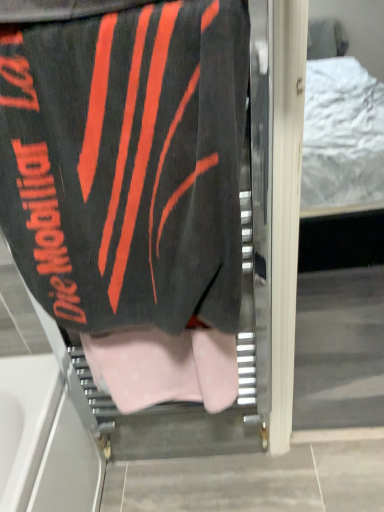
What do you see at coordinates (127, 164) in the screenshot? The width and height of the screenshot is (384, 512). I see `black fabric towel at upper left` at bounding box center [127, 164].

The width and height of the screenshot is (384, 512). Find the location of `black fabric towel at upper left`. black fabric towel at upper left is located at coordinates (127, 164).

What are the coordinates of `pink polka dot fabric at center` in the screenshot? It's located at (164, 368).

Measure the distance between point [226,385] and camera.

Point [226,385] is 37.24 inches away from camera.

The image size is (384, 512). What do you see at coordinates (164, 368) in the screenshot?
I see `pink polka dot fabric at center` at bounding box center [164, 368].

This screenshot has height=512, width=384. I want to click on black fabric towel at upper left, so click(x=127, y=164).

Between pink polka dot fabric at center and black fabric towel at upper left, which one appears on the left side from the viewer's perspective?

From the viewer's perspective, black fabric towel at upper left appears more on the left side.

Is pink polka dot fabric at center in front of or behind black fabric towel at upper left in the image?

pink polka dot fabric at center is positioned farther from the viewer than black fabric towel at upper left.

Which point is more distant from viewer, (163,375) or (90,241)?

Positioned behind is point (163,375).

From the image's perspective, is pink polka dot fabric at center above or below black fabric towel at upper left?

pink polka dot fabric at center is situated lower than black fabric towel at upper left in the image.

From a real-world perspective, is pink polka dot fabric at center positioned above or below black fabric towel at upper left?

From a real-world perspective, pink polka dot fabric at center is physically below black fabric towel at upper left.

Does pink polka dot fabric at center have a lesser width compared to black fabric towel at upper left?

Indeed, pink polka dot fabric at center has a lesser width compared to black fabric towel at upper left.

Can you confirm if pink polka dot fabric at center is taller than black fabric towel at upper left?

No.

Does pink polka dot fabric at center have a smaller size compared to black fabric towel at upper left?

Correct, pink polka dot fabric at center occupies less space than black fabric towel at upper left.

Which is correct: pink polka dot fabric at center is inside black fabric towel at upper left, or outside of it?

pink polka dot fabric at center cannot be found inside black fabric towel at upper left.

Is pink polka dot fabric at center positioned far away from black fabric towel at upper left?

pink polka dot fabric at center is actually quite close to black fabric towel at upper left.

Is pink polka dot fabric at center looking in the opposite direction of black fabric towel at upper left?

No, pink polka dot fabric at center is not facing away from black fabric towel at upper left.

Can you tell me how much pink polka dot fabric at center and black fabric towel at upper left differ in facing direction?

They differ by 0.00505 degrees in their facing directions.

Locate an element on the screen. towel in front of the pink polka dot fabric at center is located at coordinates coord(127,164).

Considering the positions of objects black fabric towel at upper left and pink polka dot fabric at center in the image provided, who is more to the right, black fabric towel at upper left or pink polka dot fabric at center?

From the viewer's perspective, pink polka dot fabric at center appears more on the right side.

Which object is closer to the camera taking this photo, black fabric towel at upper left or pink polka dot fabric at center?

Positioned in front is black fabric towel at upper left.

Is point (79, 287) positioned before point (105, 350)?

Yes, point (79, 287) is in front of point (105, 350).

From the image's perspective, is black fabric towel at upper left located above pink polka dot fabric at center?

Yes, from the image's perspective, black fabric towel at upper left is above pink polka dot fabric at center.

From a real-world perspective, relative to pink polka dot fabric at center, is black fabric towel at upper left vertically above or below?

Clearly, from a real-world perspective, black fabric towel at upper left is above pink polka dot fabric at center.

In terms of width, does black fabric towel at upper left look wider or thinner when compared to pink polka dot fabric at center?

Considering their sizes, black fabric towel at upper left looks broader than pink polka dot fabric at center.

Is black fabric towel at upper left taller than pink polka dot fabric at center?

Correct, black fabric towel at upper left is much taller as pink polka dot fabric at center.

Which of these two, black fabric towel at upper left or pink polka dot fabric at center, is bigger?

black fabric towel at upper left is bigger.

Is black fabric towel at upper left completely or partially outside of pink polka dot fabric at center?

Yes, black fabric towel at upper left is outside of pink polka dot fabric at center.

Is black fabric towel at upper left far away from pink polka dot fabric at center?

No, black fabric towel at upper left is not far from pink polka dot fabric at center.

Is black fabric towel at upper left facing away from pink polka dot fabric at center?

black fabric towel at upper left is not turned away from pink polka dot fabric at center.

Measure the distance from black fabric towel at upper left to pink polka dot fabric at center.

black fabric towel at upper left and pink polka dot fabric at center are 24.29 centimeters apart.

The image size is (384, 512). I want to click on underclothes below the black fabric towel at upper left (from the image's perspective), so click(164, 368).

You are a GUI agent. You are given a task and a screenshot of the screen. Output one action in this format:
    pyautogui.click(x=<x>, y=<y>)
    Task: Click on the towel that appears above the pink polka dot fabric at center (from a real-world perspective)
    
    Given the screenshot: What is the action you would take?
    click(x=127, y=164)

The width and height of the screenshot is (384, 512). What are the coordinates of `towel that appears on the left of pink polka dot fabric at center` in the screenshot? It's located at (127, 164).